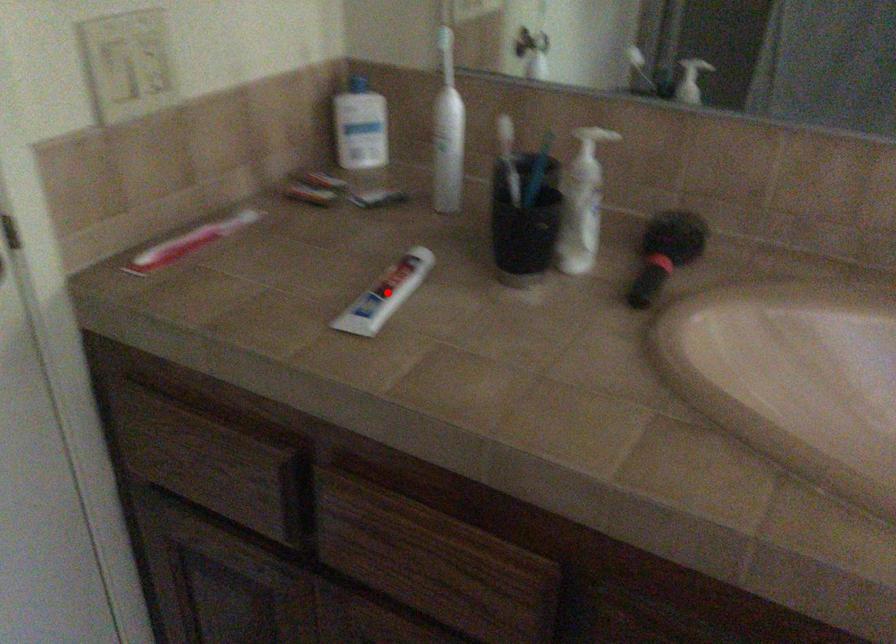
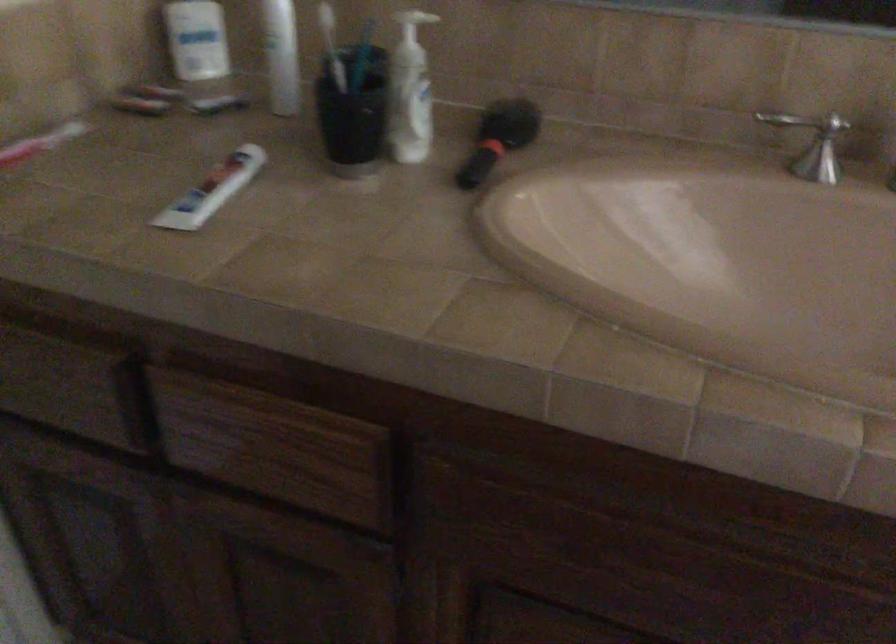
The point at the highlighted location is marked in the first image. Where is the corresponding point in the second image?

(211, 190)